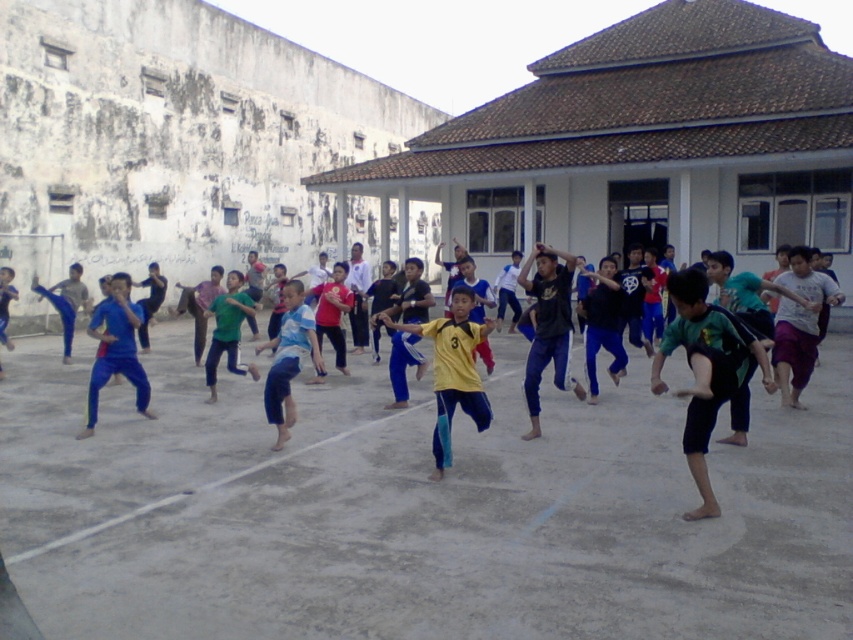
You are a photographer trying to capture a photo of the yellow jersey at center and the green fabric pants at center. Which object should you focus on first if you want to ensure both are in sharp focus, considering their heights?

The yellow jersey at center is taller than the green fabric pants at center, so focusing on the yellow jersey at center first would help ensure both are in sharp focus as it is the taller object.

You are a photographer trying to capture a photo of the yellow jersey at center and the blue fabric pants at center. Which piece of clothing should you focus on first if you want to capture them from left to right order?

The blue fabric pants at center should be focused on first because the yellow jersey at center is positioned on the right side of blue fabric pants at center, so the blue fabric pants at center is on the left.